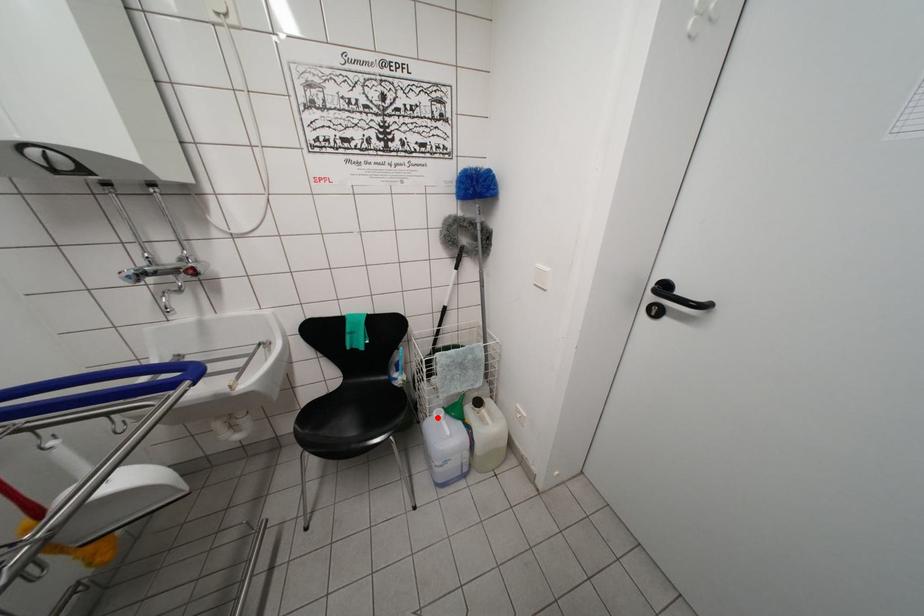
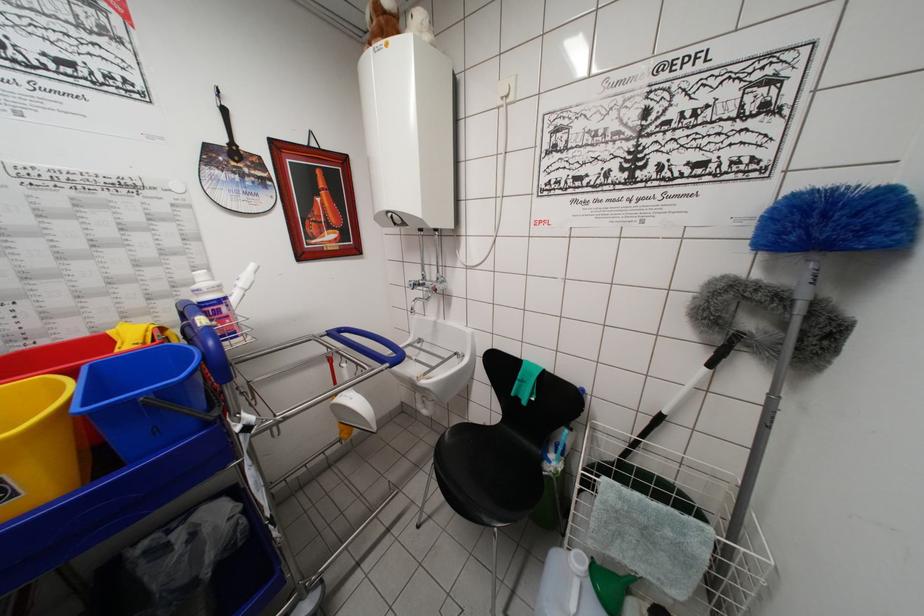
Where in the second image is the point corresponding to the highlighted location from the first image?

(576, 557)